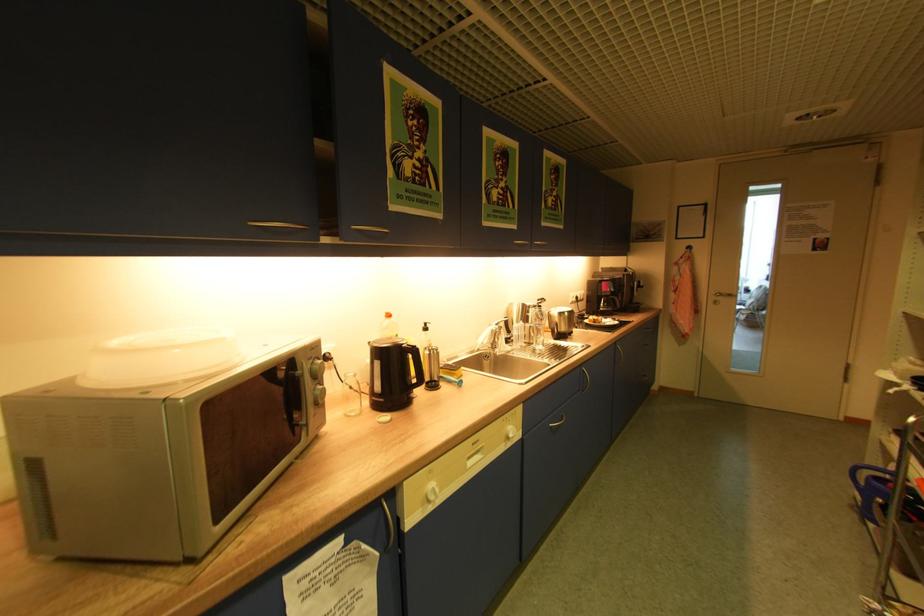
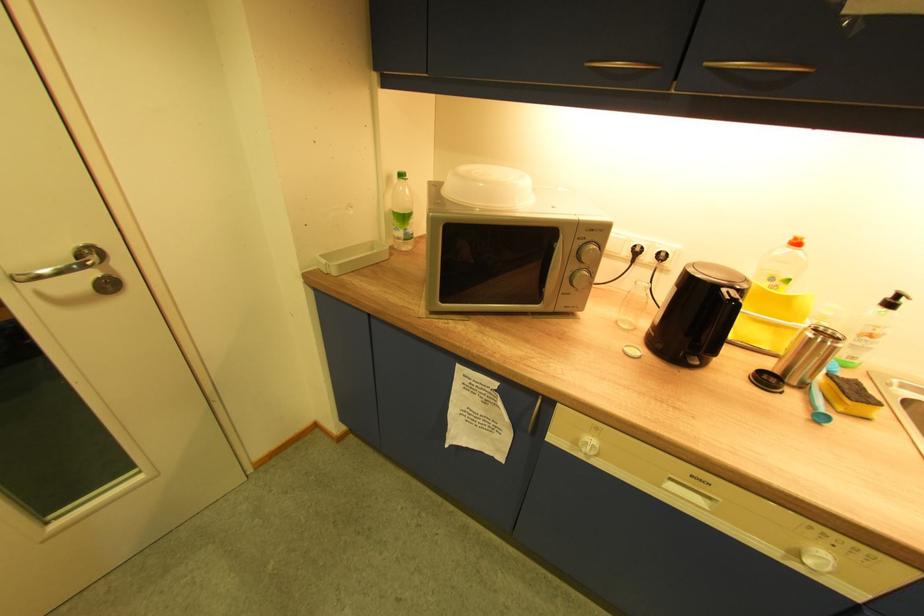
Find the pixel in the second image that matches [395,317] in the first image.

(803, 244)